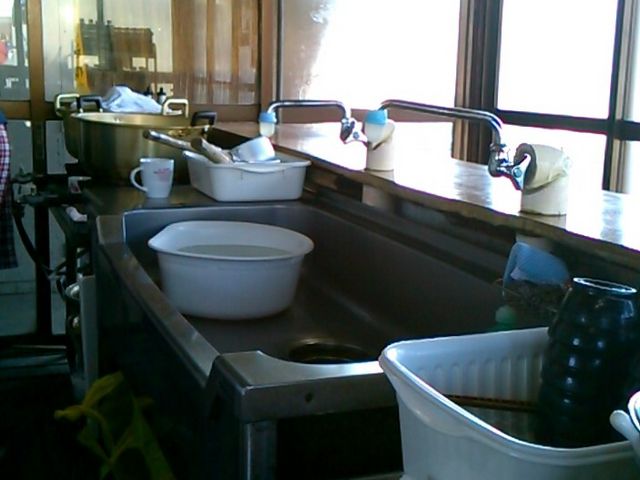
Where is `large white bowl`? The height and width of the screenshot is (480, 640). large white bowl is located at coordinates (244, 284).